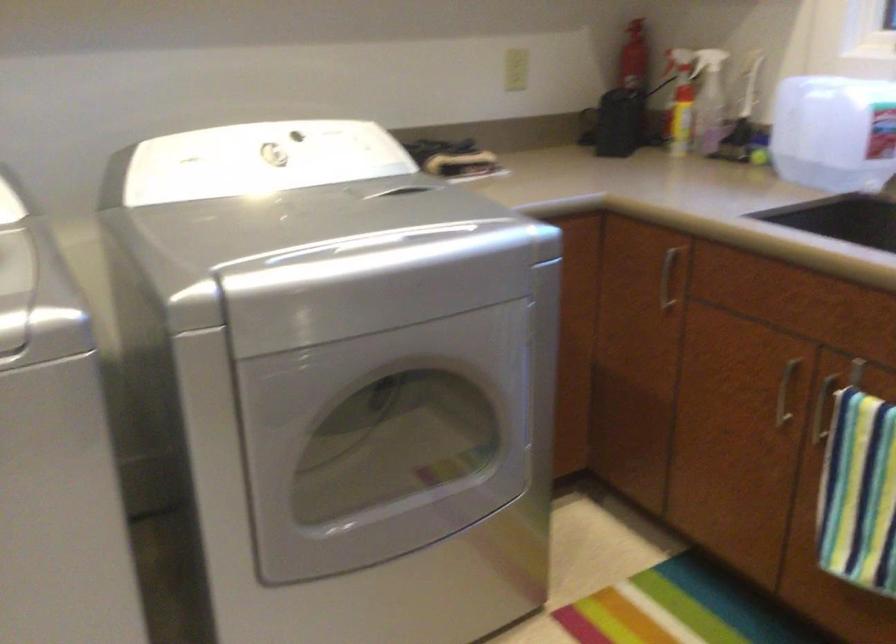
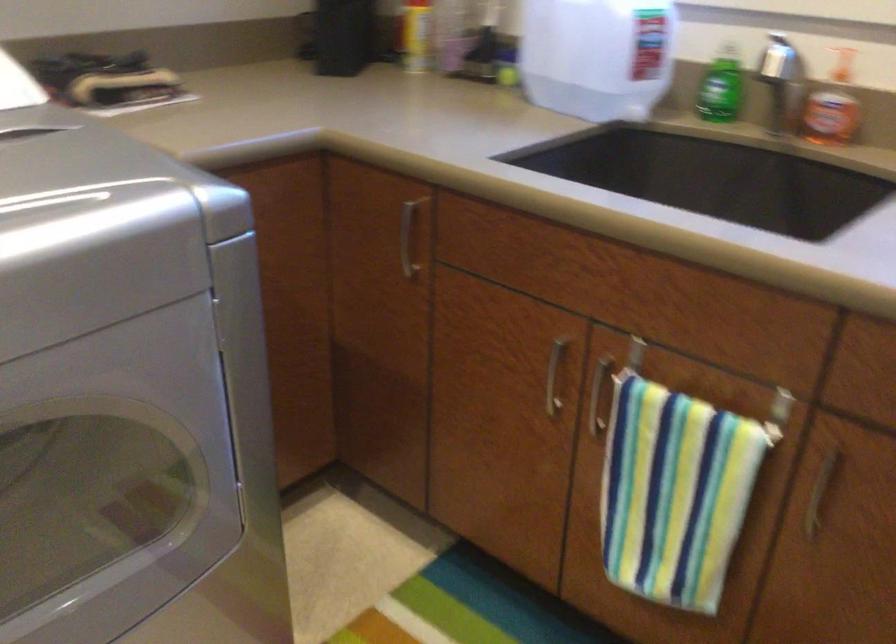
The point at [784,393] is marked in the first image. Where is the corresponding point in the second image?

(554, 375)